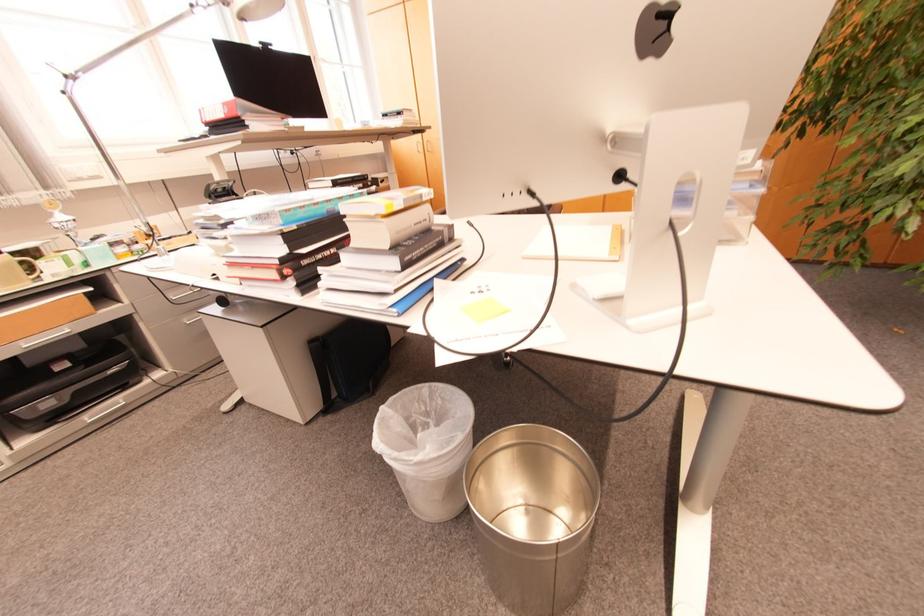
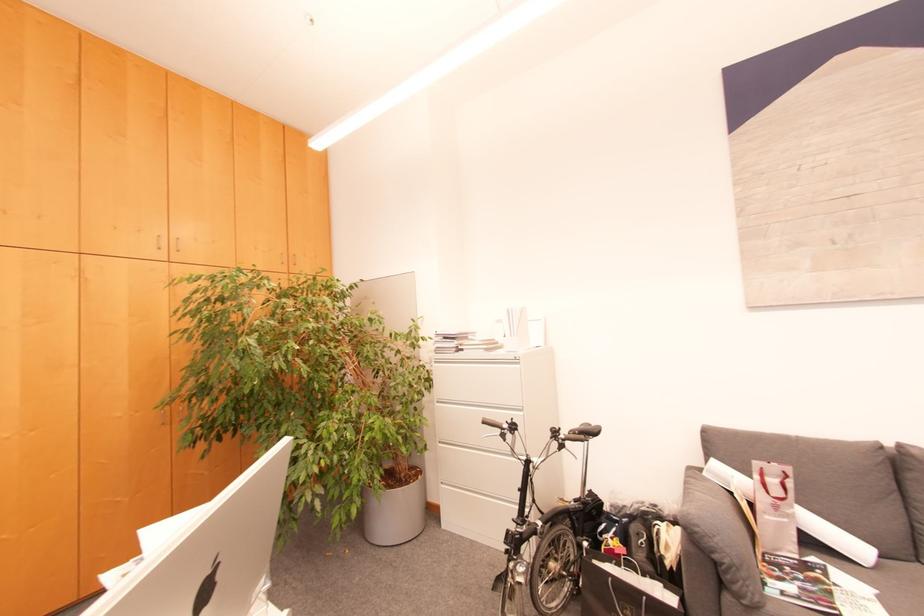
Question: The first image is from the beginning of the video and the second image is from the end. How did the camera likely rotate when shooting the video?

Choices:
 (A) Left
 (B) Right
 (C) Up
 (D) Down

Answer: (B)